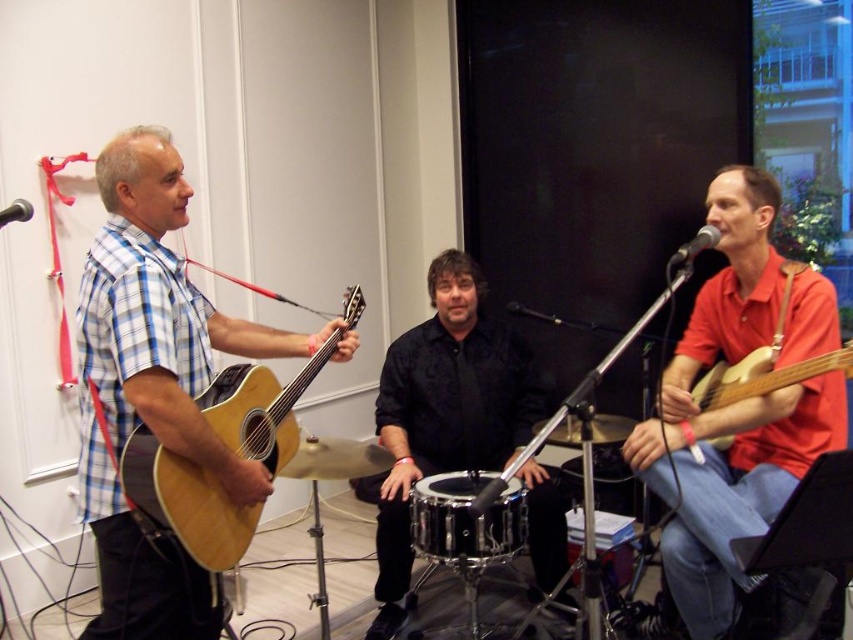
You are a GUI agent. You are given a task and a screenshot of the screen. Output one action in this format:
    pyautogui.click(x=<x>, y=<y>)
    Task: Click on the wooden acoustic guitar at right
    This screenshot has height=640, width=853.
    Given the screenshot: What is the action you would take?
    pyautogui.click(x=763, y=376)

Is point (788, 380) positioned in front of point (602, 492)?

Yes, it is in front of point (602, 492).

Find the location of a particular element. This screenshot has width=853, height=640. wooden acoustic guitar at right is located at coordinates (763, 376).

Between matte red guitar at right and black drum at center, which one is positioned higher?

matte red guitar at right

Between point (756, 321) and point (618, 451), which one is positioned in front?

Point (756, 321) is more forward.

Locate an element on the screen. matte red guitar at right is located at coordinates (737, 404).

Which is in front, point (155, 470) or point (715, 404)?

Positioned in front is point (155, 470).

Does wooden acoustic guitar at left appear under wooden acoustic guitar at right?

No, wooden acoustic guitar at left is not below wooden acoustic guitar at right.

The height and width of the screenshot is (640, 853). What do you see at coordinates (183, 504) in the screenshot?
I see `wooden acoustic guitar at left` at bounding box center [183, 504].

Find the location of `wooden acoustic guitar at left`. wooden acoustic guitar at left is located at coordinates (183, 504).